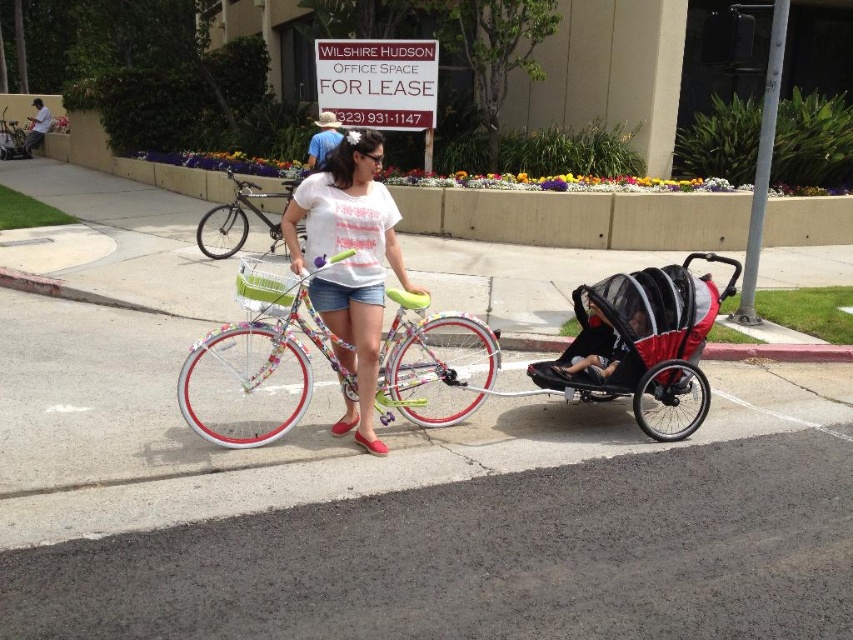
You are standing at point (26, 145) and want to walk to point (426, 381). According to the scene, is the path from your current position to the destination unobstructed?

Yes, the path from point (26, 145) to point (426, 381) is unobstructed because point (426, 381) is in front of point (26, 145), indicating no objects are blocking the way.

You are a pedestrian walking on the sidewalk and see the floral fabric shirt at center and the metallic silver bicycle at left. Which object is closer to the ground?

The floral fabric shirt at center is positioned under metallic silver bicycle at left, so the floral fabric shirt at center is closer to the ground.

Consider the image. You are a delivery person who needs to load a package onto the bicycles. The package requires placing it on top of one of the bicycles. Which bicycle, the floral painted bicycle at center or the metallic silver bicycle at center, can have the package placed on top without it falling off?

The metallic silver bicycle at center can have the package placed on top without it falling off because the floral painted bicycle at center is positioned under it, making it impossible to place the package there without it being obstructed.